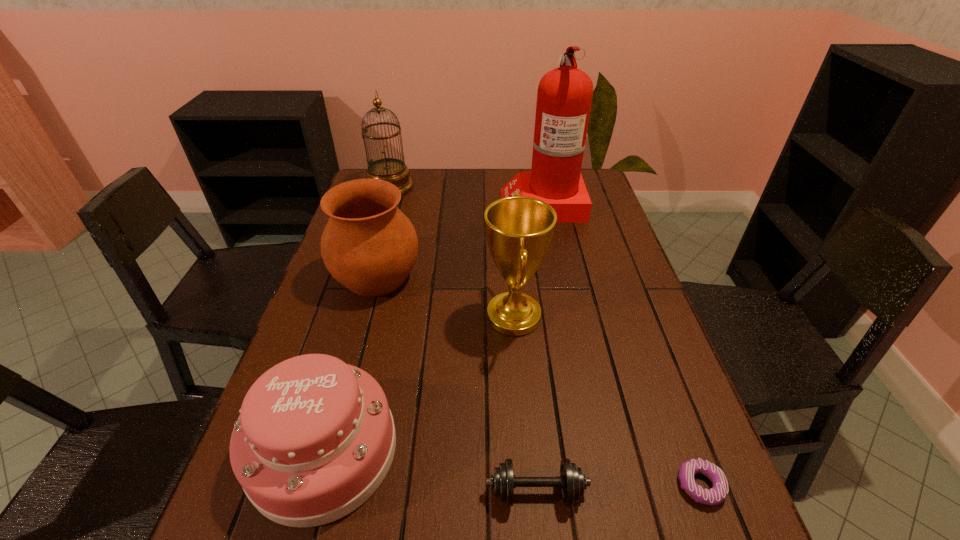
Where is `birdcage at the far edge`? birdcage at the far edge is located at coordinates (393, 170).

Locate an element on the screen. This screenshot has height=540, width=960. birdcage situated at the left edge is located at coordinates (393, 170).

Find the location of a particular element. pottery situated at the left edge is located at coordinates (369, 245).

Identify the location of cake positioned at the left edge. This screenshot has width=960, height=540. (315, 438).

Where is `fire extinguisher that is positioned at the right edge`? This screenshot has width=960, height=540. fire extinguisher that is positioned at the right edge is located at coordinates (564, 97).

Locate an element on the screen. The height and width of the screenshot is (540, 960). doughnut at the right edge is located at coordinates (718, 493).

What are the coordinates of `object located at the far left corner` in the screenshot? It's located at (393, 170).

I want to click on object present at the far right corner, so click(564, 97).

I want to click on blank area at the far edge, so click(x=436, y=178).

Find the location of a particular element. Image resolution: width=960 pixels, height=540 pixels. vacant point at the right edge is located at coordinates (678, 433).